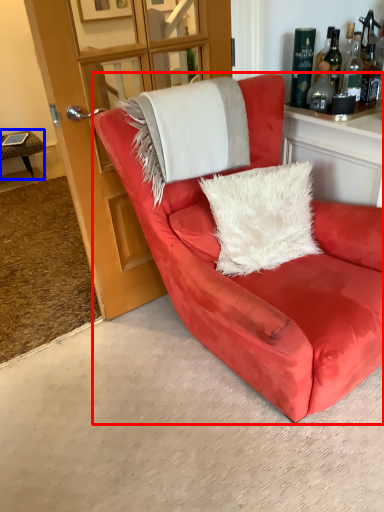
Question: Which of the following is the closest to the observer, chair (highlighted by a red box) or table (highlighted by a blue box)?

Choices:
 (A) chair
 (B) table

Answer: (A)